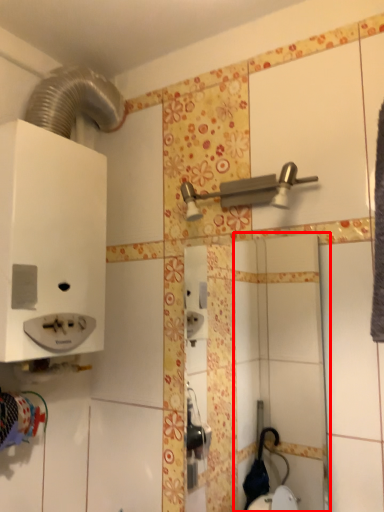
Question: From the image's perspective, where is mirror (annotated by the red box) located relative to shower?

Choices:
 (A) below
 (B) above

Answer: (A)